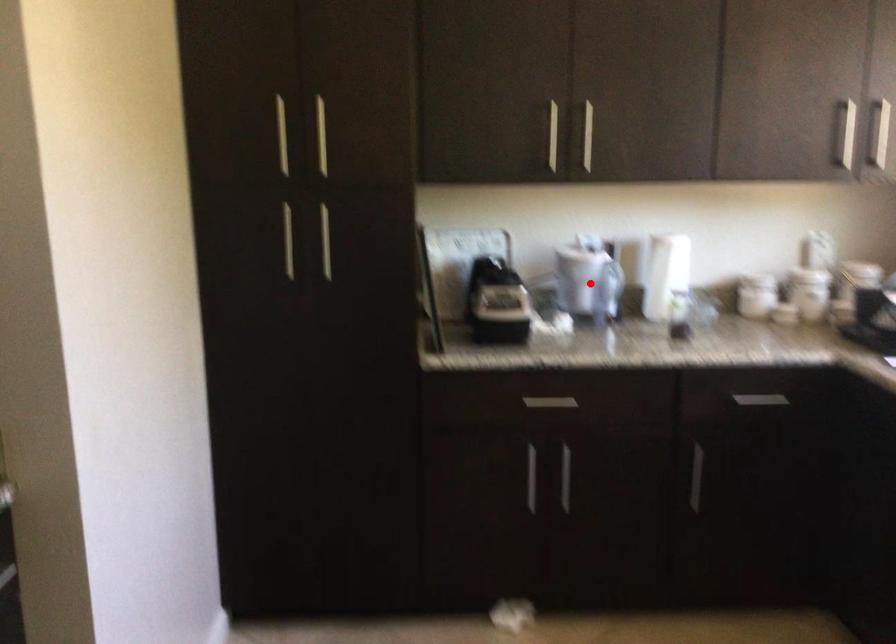
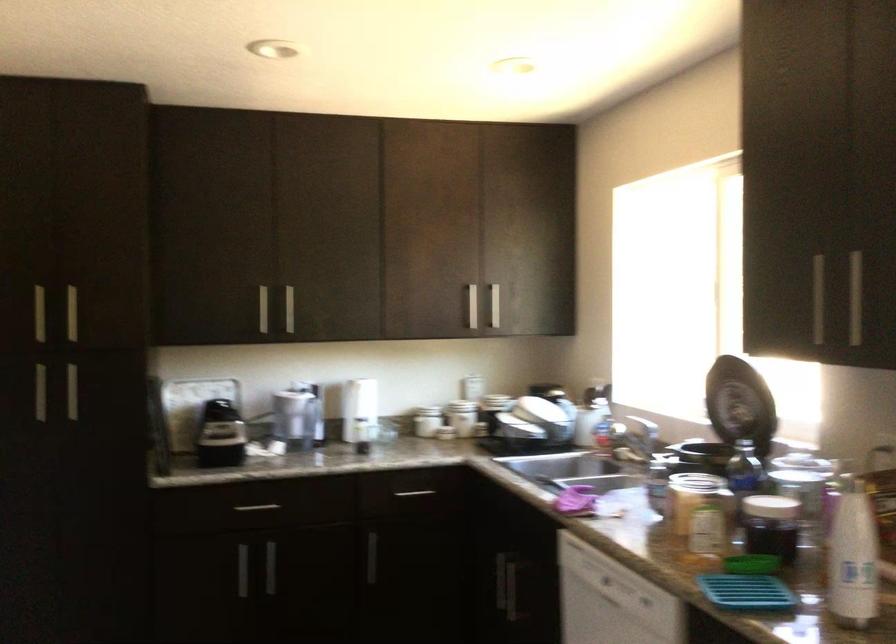
In the second image, find the point that corresponds to the highlighted location in the first image.

(296, 417)